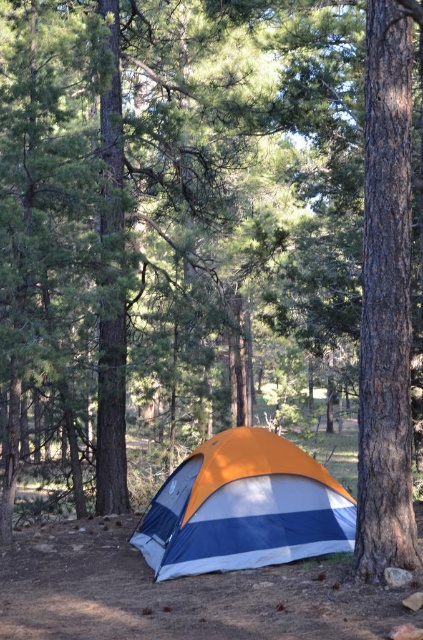
Question: Is the position of smooth brown tree trunk at right more distant than that of orange/white striped tent at center?

Choices:
 (A) yes
 (B) no

Answer: (B)

Question: Observing the image, what is the correct spatial positioning of smooth brown tree trunk at right in reference to orange/white striped tent at center?

Choices:
 (A) below
 (B) above

Answer: (B)

Question: Which object is closer to the camera taking this photo?

Choices:
 (A) orange/white striped tent at center
 (B) smooth brown tree trunk at right

Answer: (B)

Question: Which point appears closest to the camera in this image?

Choices:
 (A) (408, 100)
 (B) (282, 541)

Answer: (A)

Question: Which of the following is the closest to the observer?

Choices:
 (A) (398, 557)
 (B) (162, 531)

Answer: (A)

Question: Does smooth brown tree trunk at right have a greater width compared to orange/white striped tent at center?

Choices:
 (A) no
 (B) yes

Answer: (A)